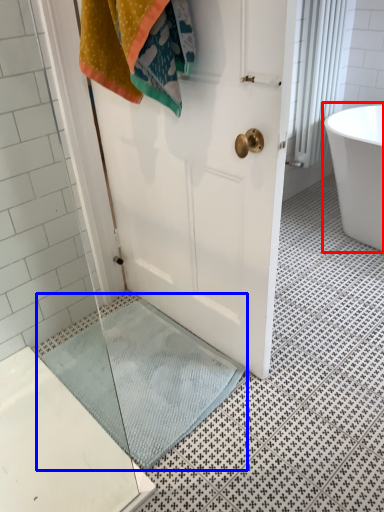
Question: Which object appears farthest to the camera in this image, bathtub (highlighted by a red box) or bath mat (highlighted by a blue box)?

Choices:
 (A) bathtub
 (B) bath mat

Answer: (A)